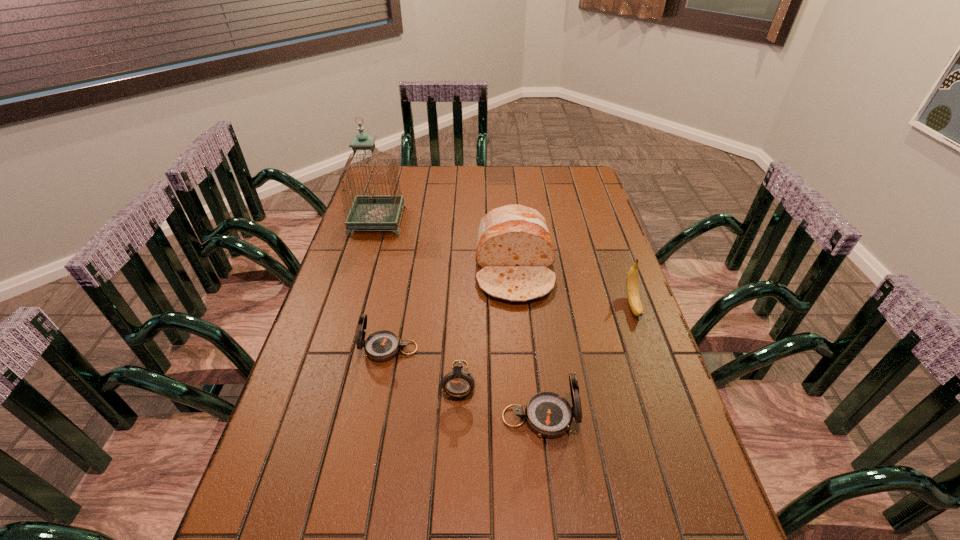
Find the location of `free spot between the rightmost compass and the bread`. free spot between the rightmost compass and the bread is located at coordinates (527, 343).

Identify the location of vacant space in between the leftmost compass and the birdcage. Image resolution: width=960 pixels, height=540 pixels. (383, 285).

Locate an element on the screen. The height and width of the screenshot is (540, 960). object that ranks as the second closest to the rightmost object is located at coordinates (548, 414).

Identify which object is the fourth nearest to the farthest object. Please provide its 2D coordinates. Your answer should be formatted as a tuple, i.e. [(x, y)], where the tuple contains the x and y coordinates of a point satisfying the conditions above.

[(548, 414)]

Choose which compass is the nearest neighbor to the rightmost object. Please provide its 2D coordinates. Your answer should be formatted as a tuple, i.e. [(x, y)], where the tuple contains the x and y coordinates of a point satisfying the conditions above.

[(548, 414)]

Choose which compass is the second nearest neighbor to the tallest object. Please provide its 2D coordinates. Your answer should be formatted as a tuple, i.e. [(x, y)], where the tuple contains the x and y coordinates of a point satisfying the conditions above.

[(458, 383)]

In order to click on free region that satisfies the following two spatial constraints: 1. at the start of the peel on the banana; 2. on the face of the rightmost compass in this screenshot , I will do `click(673, 417)`.

Locate an element on the screen. free space that satisfies the following two spatial constraints: 1. at the start of the peel on the rightmost object; 2. on the face of the second tallest compass is located at coordinates (648, 349).

At what (x,y) coordinates should I click in order to perform the action: click on blank space that satisfies the following two spatial constraints: 1. at the start of the peel on the banana; 2. on the face of the rightmost compass. Please return your answer as a coordinate pair (x, y). This screenshot has width=960, height=540. Looking at the image, I should click on (673, 417).

Identify the location of free location that satisfies the following two spatial constraints: 1. at the sliced end of the bread; 2. on the face of the leftmost compass. (521, 349).